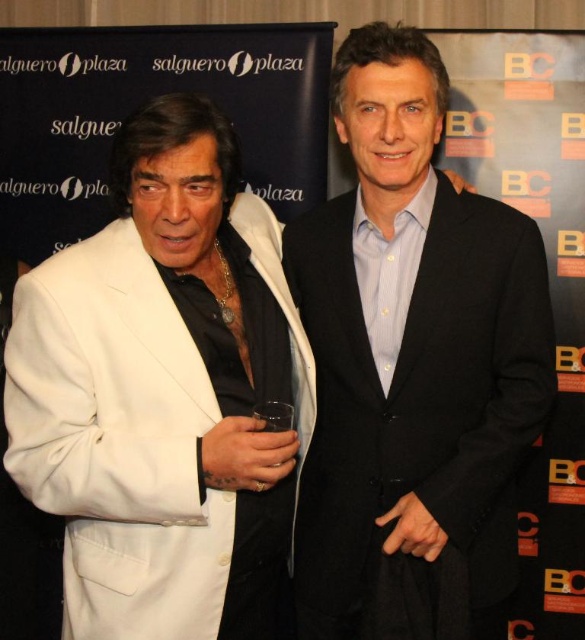
Question: Is black matte suit at center positioned in front of white matte suit at left?

Choices:
 (A) yes
 (B) no

Answer: (B)

Question: Is black matte suit at center wider than white matte suit at left?

Choices:
 (A) no
 (B) yes

Answer: (A)

Question: Is black matte suit at center below white matte suit at left?

Choices:
 (A) yes
 (B) no

Answer: (B)